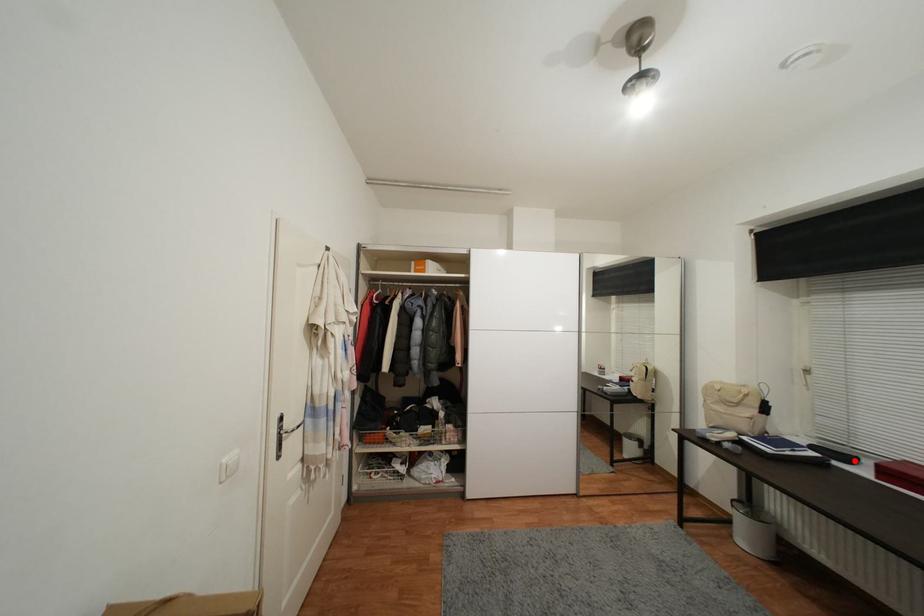
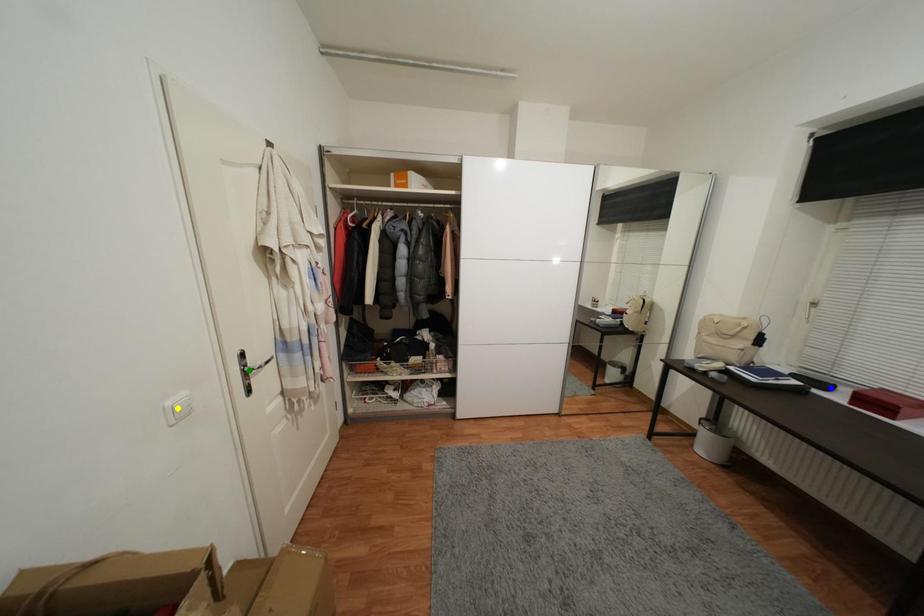
Question: I am providing you with two images of the same scene from different viewpoints. A red point is marked on the first image. You are given multiple points on the second image. Which mark in image 2 goes with the point in image 1?

Choices:
 (A) blue point
 (B) green point
 (C) yellow point

Answer: (A)